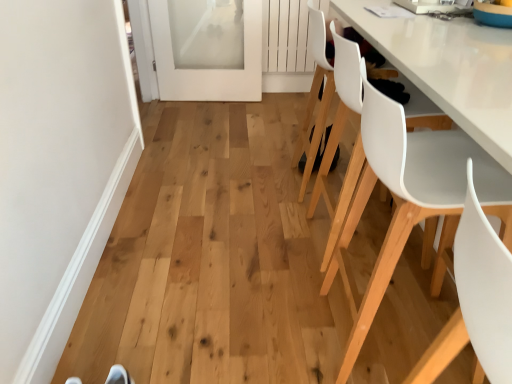
Question: Does white frosted glass door at upper left turn towards white plastic chair at center, positioned as the 2th chair in back-to-front order?

Choices:
 (A) no
 (B) yes

Answer: (B)

Question: Is white frosted glass door at upper left next to white plastic chair at center, positioned as the 2th chair in back-to-front order?

Choices:
 (A) yes
 (B) no

Answer: (B)

Question: Is white frosted glass door at upper left facing away from white plastic chair at center, positioned as the 2th chair in back-to-front order?

Choices:
 (A) no
 (B) yes

Answer: (A)

Question: From a real-world perspective, is white frosted glass door at upper left beneath white plastic chair at center, acting as the 3th chair starting from the front?

Choices:
 (A) no
 (B) yes

Answer: (B)

Question: Can you confirm if white frosted glass door at upper left is bigger than white plastic chair at center, positioned as the 2th chair in back-to-front order?

Choices:
 (A) yes
 (B) no

Answer: (B)

Question: Can you confirm if white frosted glass door at upper left is positioned to the left of white plastic chair at center, acting as the 3th chair starting from the front?

Choices:
 (A) no
 (B) yes

Answer: (B)

Question: Can you confirm if white plastic chair at right, which is the 3th chair in back-to-front order, is positioned to the left of white plastic chair at center, positioned as the 2th chair in back-to-front order?

Choices:
 (A) yes
 (B) no

Answer: (B)

Question: From the image's perspective, is white plastic chair at right, which ranks as the 2th chair in front-to-back order, on white plastic chair at center, positioned as the 2th chair in back-to-front order?

Choices:
 (A) yes
 (B) no

Answer: (B)

Question: Considering the relative sizes of white plastic chair at right, which is the 3th chair in back-to-front order, and white plastic chair at center, acting as the 3th chair starting from the front, in the image provided, is white plastic chair at right, which is the 3th chair in back-to-front order, bigger than white plastic chair at center, acting as the 3th chair starting from the front,?

Choices:
 (A) yes
 (B) no

Answer: (A)

Question: Does white plastic chair at right, which is the 3th chair in back-to-front order, have a lesser height compared to white plastic chair at center, acting as the 3th chair starting from the front?

Choices:
 (A) yes
 (B) no

Answer: (B)

Question: Could you tell me if white plastic chair at right, which ranks as the 2th chair in front-to-back order, is facing white plastic chair at center, acting as the 3th chair starting from the front?

Choices:
 (A) no
 (B) yes

Answer: (A)

Question: Is white plastic chair at right, which is the 3th chair in back-to-front order, beside white plastic chair at center, acting as the 3th chair starting from the front?

Choices:
 (A) no
 (B) yes

Answer: (A)

Question: Can you confirm if white matte chair at lower right, which is counted as the 1th chair, starting from the front, is thinner than white plastic chair at right, which ranks as the 2th chair in front-to-back order?

Choices:
 (A) yes
 (B) no

Answer: (A)